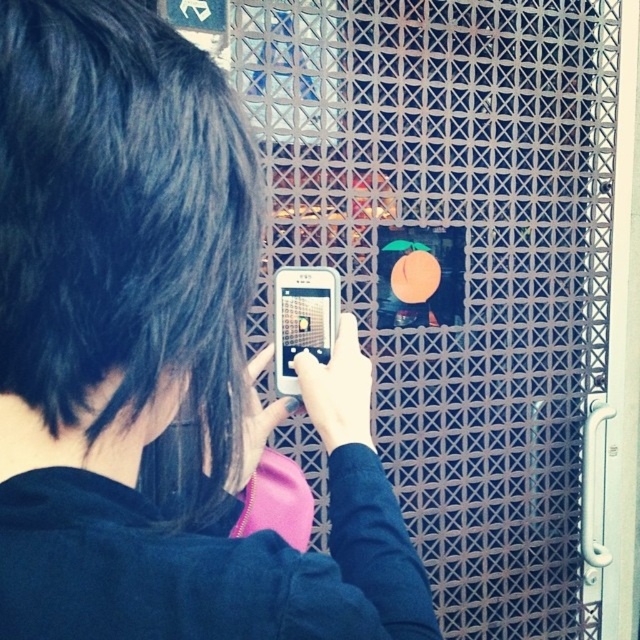
Question: Does black matte phone at center appear on the right side of white matte smartphone at center?

Choices:
 (A) no
 (B) yes

Answer: (A)

Question: Which object is closer to the camera taking this photo?

Choices:
 (A) white matte smartphone at center
 (B) black matte phone at center

Answer: (B)

Question: Which of the following is the farthest from the observer?

Choices:
 (A) (428, 620)
 (B) (298, 346)

Answer: (B)

Question: Is black matte phone at center above white matte smartphone at center?

Choices:
 (A) no
 (B) yes

Answer: (A)

Question: Is black matte phone at center bigger than white matte smartphone at center?

Choices:
 (A) yes
 (B) no

Answer: (A)